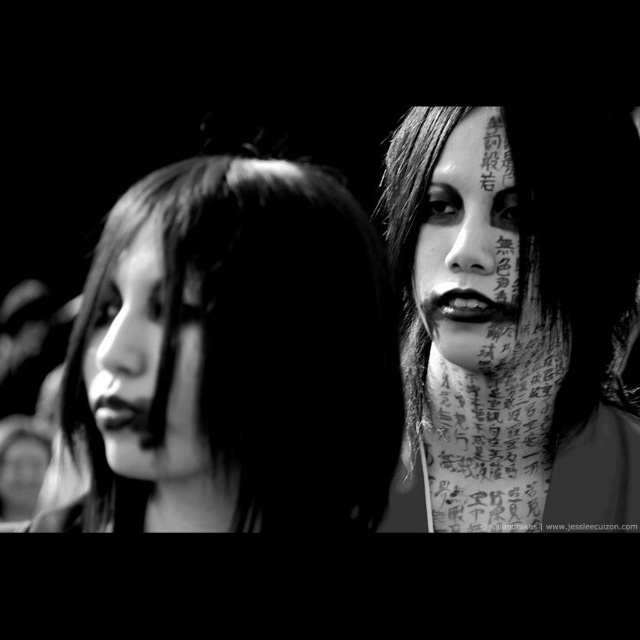
Does smooth skin face at center have a greater height compared to smooth skin tattoo at center?

No.

I want to click on smooth skin face at center, so click(x=234, y=356).

Between point (131, 355) and point (531, 394), which one is positioned behind?

The point (531, 394) is behind.

Find the location of a particular element. This screenshot has height=640, width=640. smooth skin face at center is located at coordinates (234, 356).

Does point (451, 275) come farther from viewer compared to point (148, 310)?

Yes, point (451, 275) is behind point (148, 310).

Is smooth skin face at upper right to the left of smooth skin face at left from the viewer's perspective?

Incorrect, smooth skin face at upper right is not on the left side of smooth skin face at left.

The height and width of the screenshot is (640, 640). I want to click on smooth skin face at upper right, so click(x=470, y=248).

Does smooth skin tattoo at center appear on the right side of smooth skin face at upper right?

Correct, you'll find smooth skin tattoo at center to the right of smooth skin face at upper right.

Is the position of smooth skin tattoo at center less distant than that of smooth skin face at upper right?

Yes.

Does point (440, 166) lie in front of point (515, 280)?

No.

The image size is (640, 640). I want to click on smooth skin tattoo at center, so click(x=513, y=316).